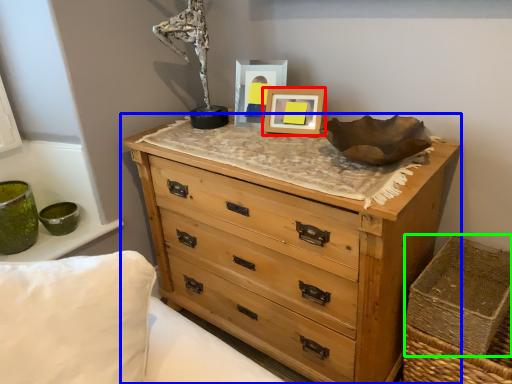
Question: Estimate the real-world distances between objects in this image. Which object is closer to picture frame (highlighted by a red box), chest of drawers (highlighted by a blue box) or crate (highlighted by a green box)?

Choices:
 (A) chest of drawers
 (B) crate

Answer: (A)